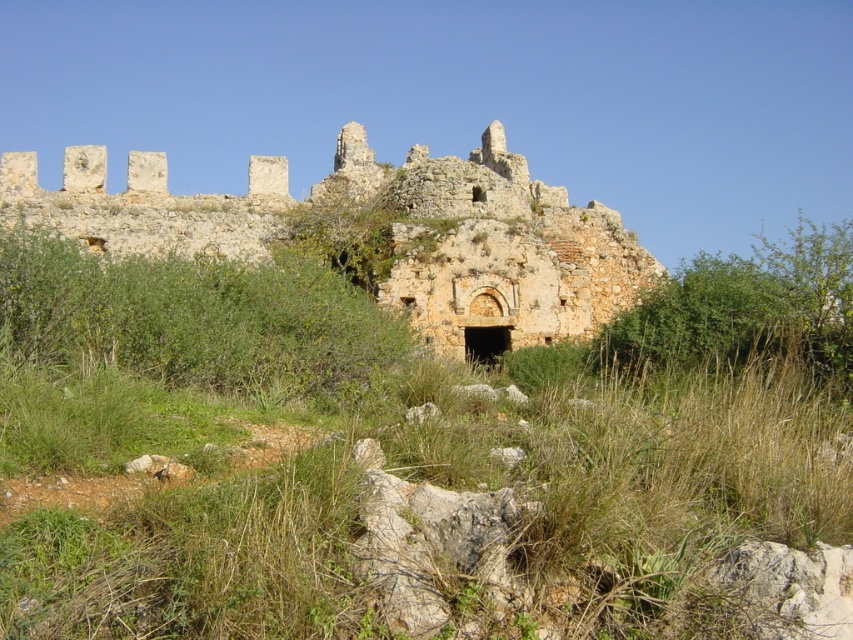
You are standing at the entrance of the ancient stone structure and notice two green elements at the center of the scene. Which one is closer to you, the green grass at center or the green leafy bush at center?

The green grass at center is closer to you as it is positioned in front of the green leafy bush at center.

You are standing in front of the rustic stone castle at center and the green leafy bush at center. Which object is closer to you?

The rustic stone castle at center is closer to you than the green leafy bush at center.

You are an explorer standing in front of the ancient stone structure. You notice a rustic stone castle at center and a green leafy bush at center. Which object is located to the left of the other?

The green leafy bush at center is located to the left of the rustic stone castle at center because the castle is on the right side of the bush.